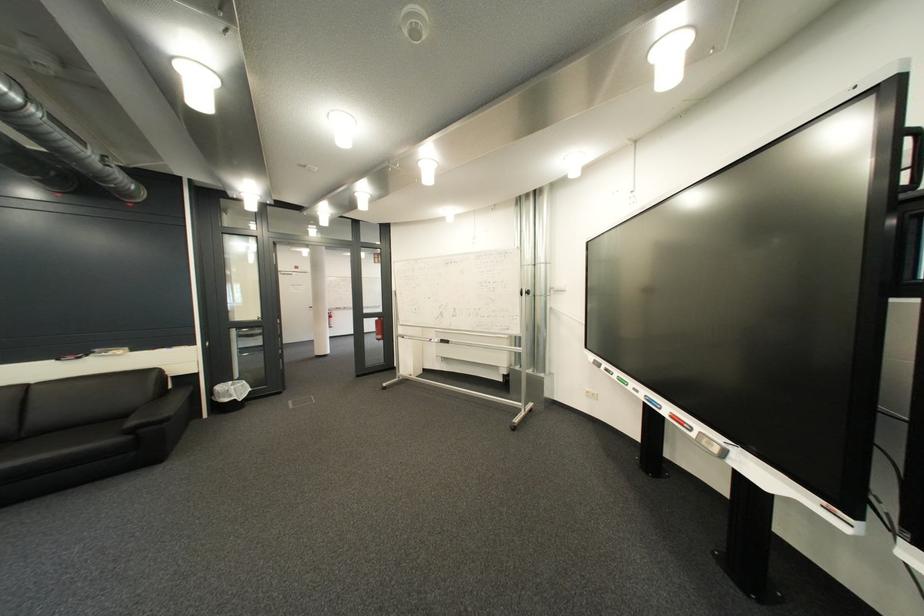
What do you see at coordinates (711, 446) in the screenshot?
I see `a whiteboard frame knob` at bounding box center [711, 446].